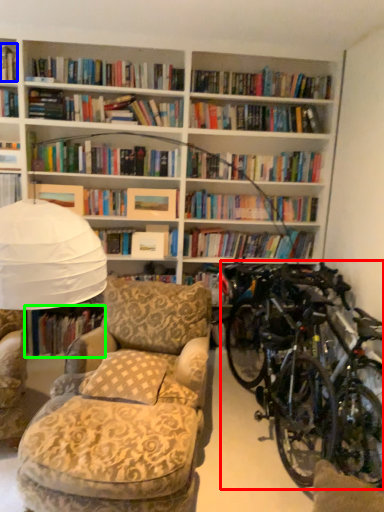
Question: Which object is the closest to the bicycle (highlighted by a red box)? Choose among these: book (highlighted by a blue box) or book (highlighted by a green box).

Choices:
 (A) book
 (B) book

Answer: (B)